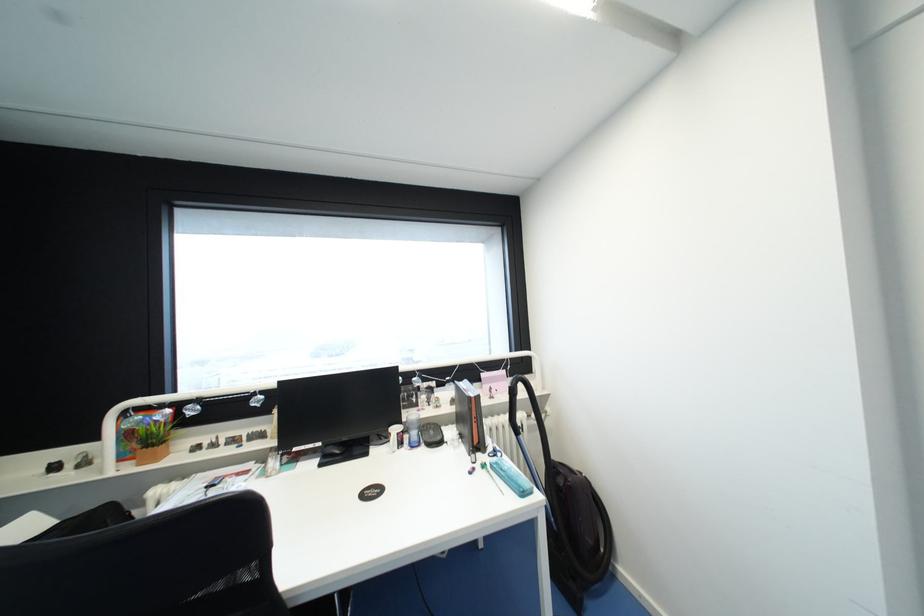
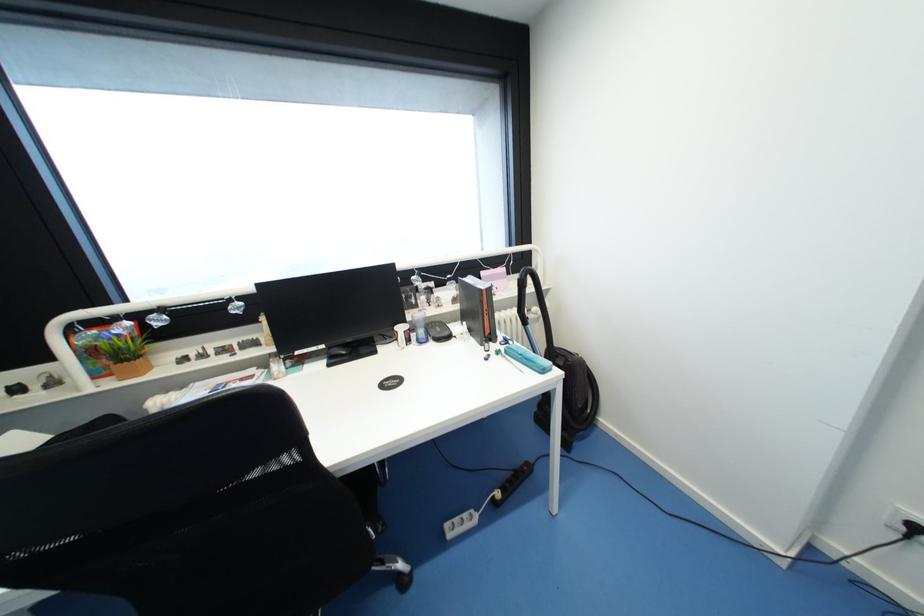
Which direction would the cameraman need to move to produce the second image?

The movement direction of the cameraman is left, forward.